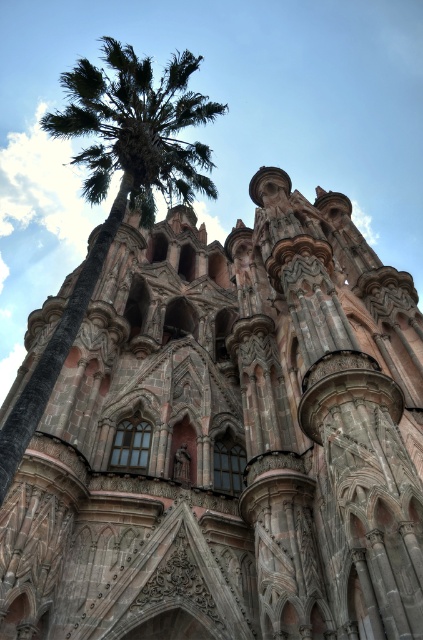
You are standing in front of the Gothic Revival building and want to take a photo. You notice two points marked on your camera screen at coordinates point [191,461] and point [206,161]. Which point is closer to your camera lens?

Point [191,461] is closer to the camera lens than point [206,161].

You are standing in front of the carved stone church at center and want to take a photo of the green leafy palm tree at left. Since the palm tree is behind the church, will it be partially hidden in your photo?

The carved stone church at center is further to the viewer than the green leafy palm tree at left, so the palm tree is actually behind the church. This means the palm tree might be partially hidden by the church in your photo.